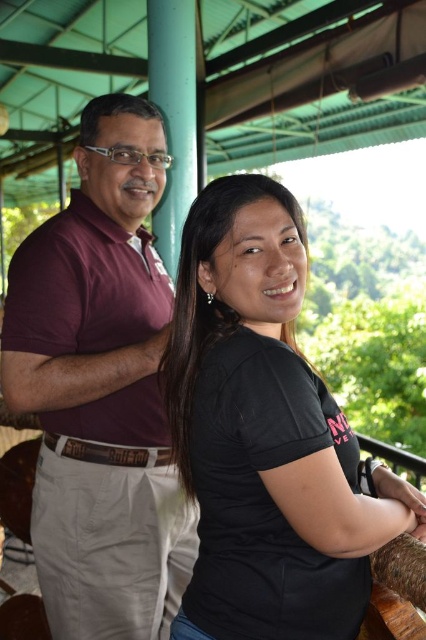
Question: Does black matte shirt at center come in front of maroon cotton shirt at left?

Choices:
 (A) no
 (B) yes

Answer: (B)

Question: Can you confirm if black matte shirt at center is smaller than maroon cotton shirt at left?

Choices:
 (A) no
 (B) yes

Answer: (B)

Question: Among these objects, which one is farthest from the camera?

Choices:
 (A) black matte shirt at center
 (B) maroon cotton shirt at left

Answer: (B)

Question: Can you confirm if black matte shirt at center is positioned above maroon cotton shirt at left?

Choices:
 (A) no
 (B) yes

Answer: (B)